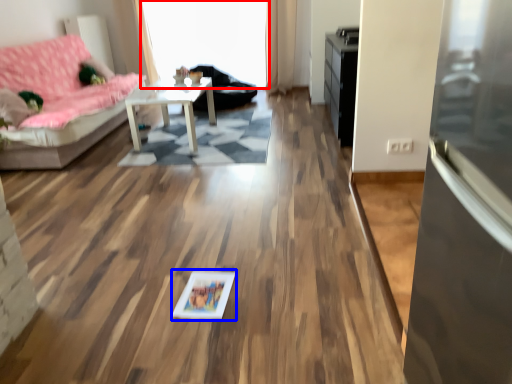
Question: Which object is closer to the camera taking this photo, window screen (highlighted by a red box) or picture frame (highlighted by a blue box)?

Choices:
 (A) window screen
 (B) picture frame

Answer: (B)